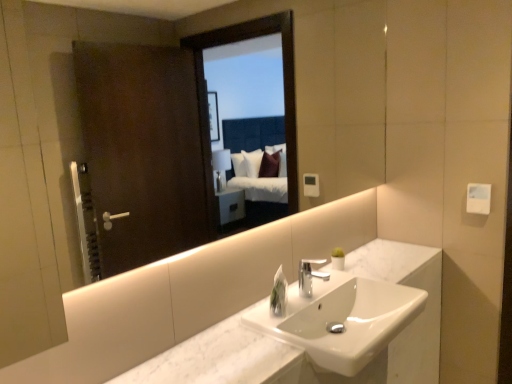
Question: Considering their positions, is silver metallic faucet at center located in front of or behind white marble counter at center?

Choices:
 (A) front
 (B) behind

Answer: (B)

Question: Looking at their shapes, would you say silver metallic faucet at center is wider or thinner than white marble counter at center?

Choices:
 (A) thin
 (B) wide

Answer: (A)

Question: Which object is positioned closest to the silver metallic faucet at center?

Choices:
 (A) white marble sink at center
 (B) clear plastic soap dispenser at center
 (C) white marble counter at center

Answer: (B)

Question: Based on their relative distances, which object is nearer to the white marble counter at center?

Choices:
 (A) clear plastic soap dispenser at center
 (B) white marble sink at center
 (C) silver metallic faucet at center

Answer: (B)